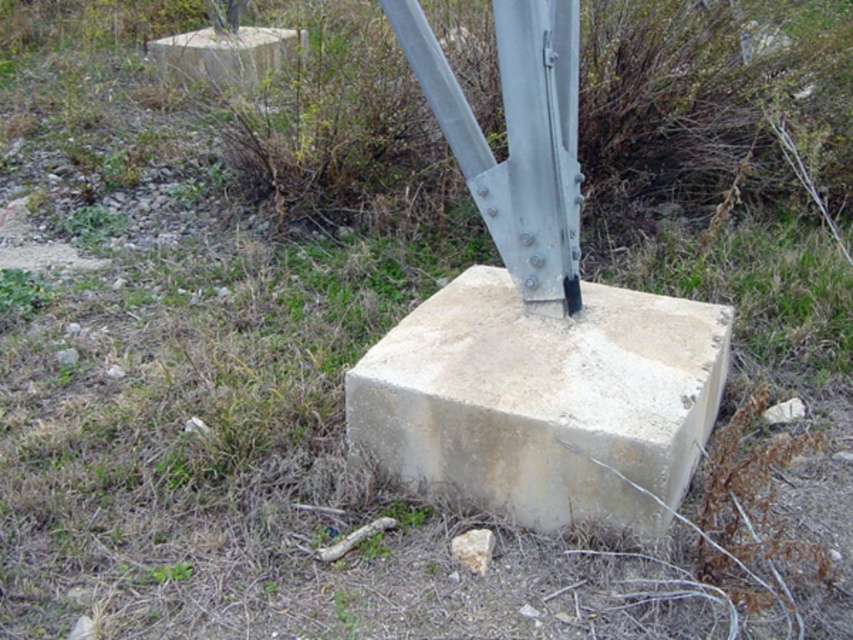
You are a construction worker inspecting the site. You see the light gray concrete block at center and the beige concrete block at upper left. Which one is positioned lower in the image?

The light gray concrete block at center is located below the beige concrete block at upper left, so it is positioned lower in the image.

You are standing in a grassy area with scattered rocks and want to place a 2.0 meter long ladder against the light gray concrete block at center. Can you safely place the ladder there without it extending beyond the concrete block?

The light gray concrete block at center is 1.89 meters away from the viewer. Since the ladder is 2.0 meters long, placing it against the block may cause the ladder to extend beyond the block by approximately 0.11 meters. Therefore, it might not be safe to place the ladder there as the ladder would overhang the edge of the concrete block.